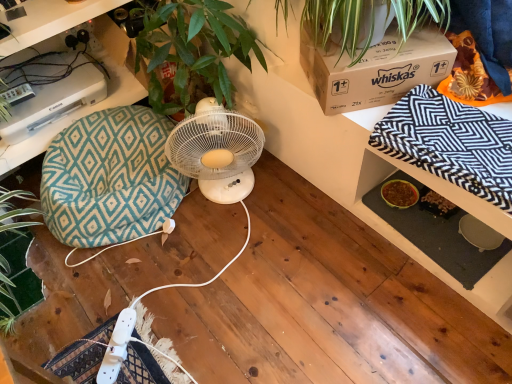
In order to click on teal fabric cushion at left in this screenshot , I will do `click(51, 20)`.

What do you see at coordinates (110, 178) in the screenshot? The image size is (512, 384). I see `teal diamond-patterned bean bag chair at left` at bounding box center [110, 178].

At what (x,y) coordinates should I click in order to perform the action: click on teal fabric cushion at left. Please return your answer as a coordinate pair (x, y). This screenshot has width=512, height=384. Looking at the image, I should click on [x=51, y=20].

Between teal diamond-patterned bean bag chair at left and brown cardboard box at upper right, which one has smaller size?

Smaller between the two is brown cardboard box at upper right.

Is teal diamond-patterned bean bag chair at left in front of brown cardboard box at upper right?

That is False.

How far apart are teal diamond-patterned bean bag chair at left and brown cardboard box at upper right?

A distance of 30.92 inches exists between teal diamond-patterned bean bag chair at left and brown cardboard box at upper right.

Can you tell me how much teal diamond-patterned bean bag chair at left and brown cardboard box at upper right differ in facing direction?

28.9 degrees.

Which object is positioned more to the left, white plastic fan at center or black and white zigzag blanket at upper right?

white plastic fan at center.

From a real-world perspective, who is located lower, white plastic fan at center or black and white zigzag blanket at upper right?

white plastic fan at center.

Is white plastic fan at center oriented towards black and white zigzag blanket at upper right?

No, white plastic fan at center is not facing towards black and white zigzag blanket at upper right.

Looking at this image, can you tell me how much white plastic fan at center and black and white zigzag blanket at upper right differ in facing direction?

The angle between the facing direction of white plastic fan at center and the facing direction of black and white zigzag blanket at upper right is 57.3 degrees.

Is brown cardboard box at upper right thinner than teal fabric cushion at left?

Incorrect, the width of brown cardboard box at upper right is not less than that of teal fabric cushion at left.

Consider the image. Is brown cardboard box at upper right to the left of teal fabric cushion at left from the viewer's perspective?

Incorrect, brown cardboard box at upper right is not on the left side of teal fabric cushion at left.

At what (x,y) coordinates should I click in order to perform the action: click on box on the right of teal fabric cushion at left. Please return your answer as a coordinate pair (x, y). This screenshot has width=512, height=384. Looking at the image, I should click on 375,69.

Would you say brown cardboard box at upper right is outside teal fabric cushion at left?

Yes, brown cardboard box at upper right is located beyond the bounds of teal fabric cushion at left.

Is white plastic fan at center taller than brown cardboard box at upper right?

Correct, white plastic fan at center is much taller as brown cardboard box at upper right.

Considering the points (198, 149) and (388, 34), which point is behind, point (198, 149) or point (388, 34)?

Point (198, 149)

Where is `box that appears above the white plastic fan at center (from a real-world perspective)`? The height and width of the screenshot is (384, 512). box that appears above the white plastic fan at center (from a real-world perspective) is located at coordinates (375, 69).

Does white plastic fan at center appear on the left side of brown cardboard box at upper right?

Yes.

From the image's perspective, is white plastic fan at center above or below teal fabric cushion at left?

white plastic fan at center is situated lower than teal fabric cushion at left in the image.

Find the location of a particular element. desk located above the white plastic fan at center (from the image's perspective) is located at coordinates (51, 20).

Is white plastic fan at center looking in the opposite direction of teal fabric cushion at left?

That's not correct — white plastic fan at center is not looking away from teal fabric cushion at left.

Would you say white plastic fan at center contains teal fabric cushion at left?

No, teal fabric cushion at left is not inside white plastic fan at center.

Does black and white zigzag blanket at upper right turn towards white plastic fan at center?

No, black and white zigzag blanket at upper right is not aimed at white plastic fan at center.

Is the depth of black and white zigzag blanket at upper right greater than that of white plastic fan at center?

No, black and white zigzag blanket at upper right is in front of white plastic fan at center.

From the image's perspective, between black and white zigzag blanket at upper right and white plastic fan at center, who is located below?

white plastic fan at center is shown below in the image.

Is teal fabric cushion at left positioned beyond the bounds of black and white zigzag blanket at upper right?

teal fabric cushion at left lies outside black and white zigzag blanket at upper right's area.

Does teal fabric cushion at left have a lesser height compared to black and white zigzag blanket at upper right?

Indeed, teal fabric cushion at left has a lesser height compared to black and white zigzag blanket at upper right.

Is teal fabric cushion at left aimed at black and white zigzag blanket at upper right?

No, teal fabric cushion at left is not aimed at black and white zigzag blanket at upper right.

Which is in front, point (121, 88) or point (450, 125)?

The point (450, 125) is in front.

This screenshot has height=384, width=512. I want to click on box on the right side of teal diamond-patterned bean bag chair at left, so click(x=375, y=69).

The height and width of the screenshot is (384, 512). Find the location of `mechanical fan on the left of black and white zigzag blanket at upper right`. mechanical fan on the left of black and white zigzag blanket at upper right is located at coordinates (217, 151).

Estimate the real-world distances between objects in this image. Which object is closer to black and white zigzag blanket at upper right, teal fabric cushion at left or brown cardboard box at upper right?

Among the two, brown cardboard box at upper right is located nearer to black and white zigzag blanket at upper right.

From the image, which object appears to be nearer to black and white zigzag blanket at upper right, white plastic fan at center or brown cardboard box at upper right?

brown cardboard box at upper right is closer to black and white zigzag blanket at upper right.

Looking at the image, which one is located closer to teal fabric cushion at left, black and white zigzag blanket at upper right or teal diamond-patterned bean bag chair at left?

Among the two, teal diamond-patterned bean bag chair at left is located nearer to teal fabric cushion at left.

When comparing their distances from teal fabric cushion at left, does brown cardboard box at upper right or white plastic fan at center seem closer?

white plastic fan at center lies closer to teal fabric cushion at left than the other object.

Looking at the image, which one is located closer to brown cardboard box at upper right, teal fabric cushion at left or white plastic fan at center?

white plastic fan at center lies closer to brown cardboard box at upper right than the other object.

When comparing their distances from white plastic fan at center, does brown cardboard box at upper right or teal diamond-patterned bean bag chair at left seem closer?

teal diamond-patterned bean bag chair at left lies closer to white plastic fan at center than the other object.

Which object lies further to the anchor point brown cardboard box at upper right, white plastic fan at center or black and white zigzag blanket at upper right?

white plastic fan at center.

Considering their positions, is teal fabric cushion at left positioned closer to brown cardboard box at upper right than black and white zigzag blanket at upper right?

Based on the image, black and white zigzag blanket at upper right appears to be nearer to brown cardboard box at upper right.

Locate an element on the screen. The height and width of the screenshot is (384, 512). box between teal diamond-patterned bean bag chair at left and black and white zigzag blanket at upper right from left to right is located at coordinates (375, 69).

The height and width of the screenshot is (384, 512). Identify the location of mechanical fan located between teal diamond-patterned bean bag chair at left and black and white zigzag blanket at upper right in the left-right direction. (217, 151).

Locate an element on the screen. This screenshot has width=512, height=384. box between white plastic fan at center and black and white zigzag blanket at upper right in the horizontal direction is located at coordinates (375, 69).

At what (x,y) coordinates should I click in order to perform the action: click on bean bag chair between teal fabric cushion at left and white plastic fan at center from left to right. Please return your answer as a coordinate pair (x, y). Looking at the image, I should click on (110, 178).